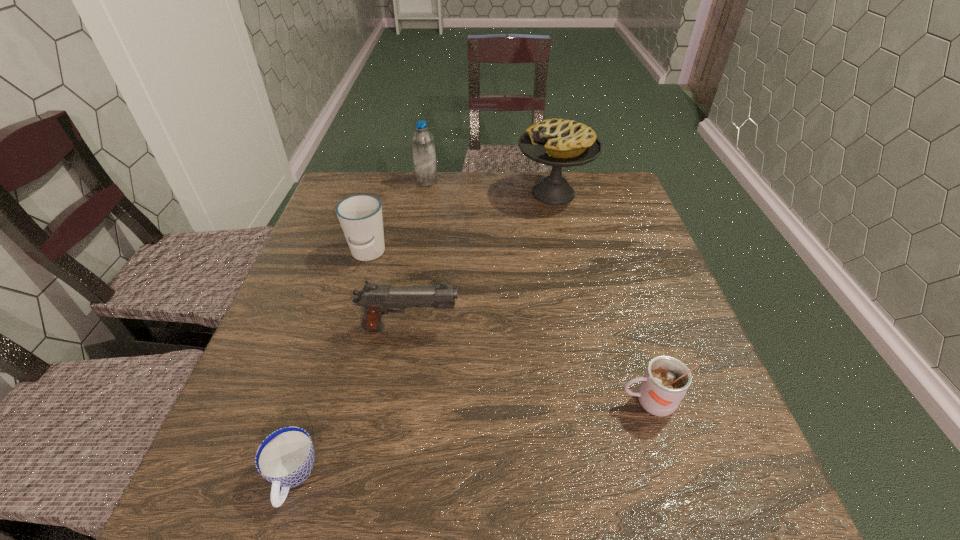
The height and width of the screenshot is (540, 960). In order to click on object located in the near edge section of the desktop in this screenshot , I will do `click(285, 458)`.

The width and height of the screenshot is (960, 540). What are the coordinates of `pie located in the right edge section of the desktop` in the screenshot? It's located at (559, 143).

Identify the location of cup located in the right edge section of the desktop. (666, 380).

This screenshot has width=960, height=540. I want to click on object that is positioned at the near left corner, so click(x=285, y=458).

Identify the location of object that is positioned at the far right corner. The height and width of the screenshot is (540, 960). (559, 143).

This screenshot has height=540, width=960. In the image, there is a desktop. Identify the location of vacant space at the far edge. (405, 211).

At what (x,y) coordinates should I click in order to perform the action: click on free point at the left edge. Please return your answer as a coordinate pair (x, y). Image resolution: width=960 pixels, height=540 pixels. Looking at the image, I should click on (337, 254).

Find the location of `vacant space at the right edge of the desktop`. vacant space at the right edge of the desktop is located at coordinates (616, 298).

Where is `free space at the near left corner`? The width and height of the screenshot is (960, 540). free space at the near left corner is located at coordinates (228, 503).

Locate an element on the screen. This screenshot has height=540, width=960. vacant space at the near right corner of the desktop is located at coordinates (725, 502).